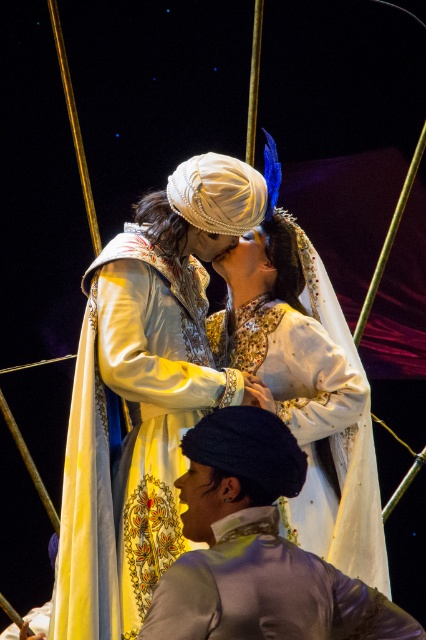
In the scene shown: In the scene, there are two central items of clothing, the silk embroidered dress at center and the silvery metallic jacket at center. Which one is positioned higher in the image?

The silk embroidered dress at center is above the silvery metallic jacket at center, so it is positioned higher in the image.

In the scene depicting a dramatic moment between two individuals in traditional attire, which object is shorter between the silvery metallic jacket at center and the white embroidered dress at center?

The silvery metallic jacket at center is shorter than the white embroidered dress at center.